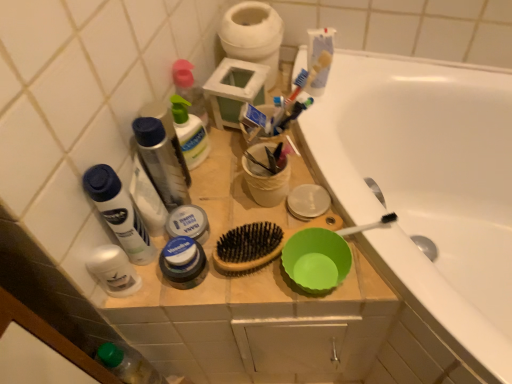
Locate an element on the screen. unoccupied region to the right of white matte deodorant at left, marked as the 5th toiletry in a top-to-bottom arrangement is located at coordinates (221, 271).